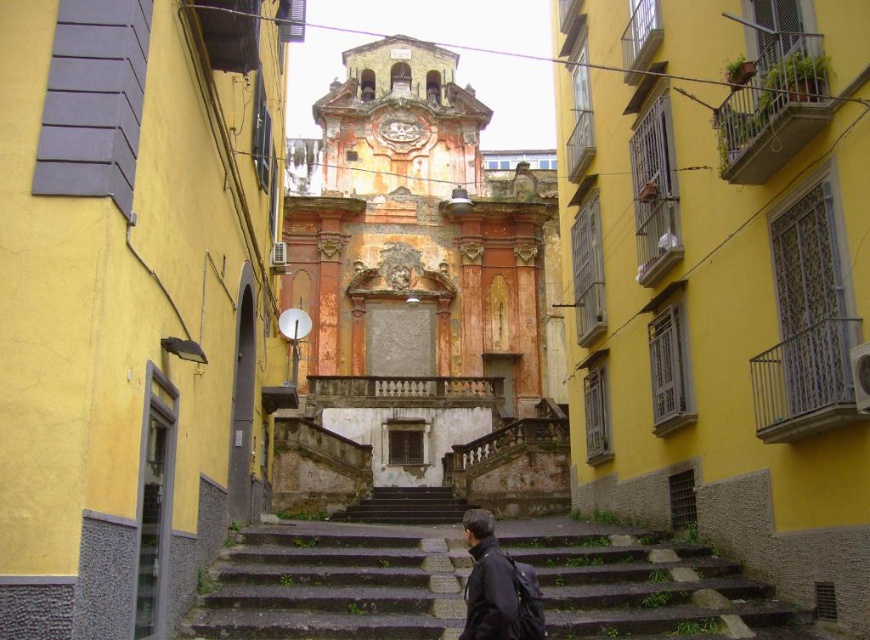
Looking at this image, which is more to the right, stone steps at center or dark gray concrete stairs at center?

From the viewer's perspective, stone steps at center appears more on the right side.

Can you confirm if stone steps at center is wider than dark gray concrete stairs at center?

Indeed, stone steps at center has a greater width compared to dark gray concrete stairs at center.

The image size is (870, 640). What are the coordinates of `stone steps at center` in the screenshot? It's located at (333, 582).

At what (x,y) coordinates should I click in order to perform the action: click on stone steps at center. Please return your answer as a coordinate pair (x, y). Image resolution: width=870 pixels, height=640 pixels. Looking at the image, I should click on (333, 582).

Is weathered orange church at center bigger than stone steps at center?

Correct, weathered orange church at center is larger in size than stone steps at center.

Does weathered orange church at center appear on the right side of stone steps at center?

No, weathered orange church at center is not to the right of stone steps at center.

Measure the distance between point (507,291) and camera.

Point (507,291) is 346.40 feet from camera.

Find the location of a particular element. The height and width of the screenshot is (640, 870). weathered orange church at center is located at coordinates (425, 280).

This screenshot has height=640, width=870. In order to click on stone steps at center in this screenshot , I will do `click(333, 582)`.

Does stone steps at center have a lesser height compared to dark matte jacket at lower center?

Yes.

Between point (291, 524) and point (480, 563), which one is positioned behind?

The point (291, 524) is more distant.

Where is `stone steps at center`? Image resolution: width=870 pixels, height=640 pixels. stone steps at center is located at coordinates (333, 582).